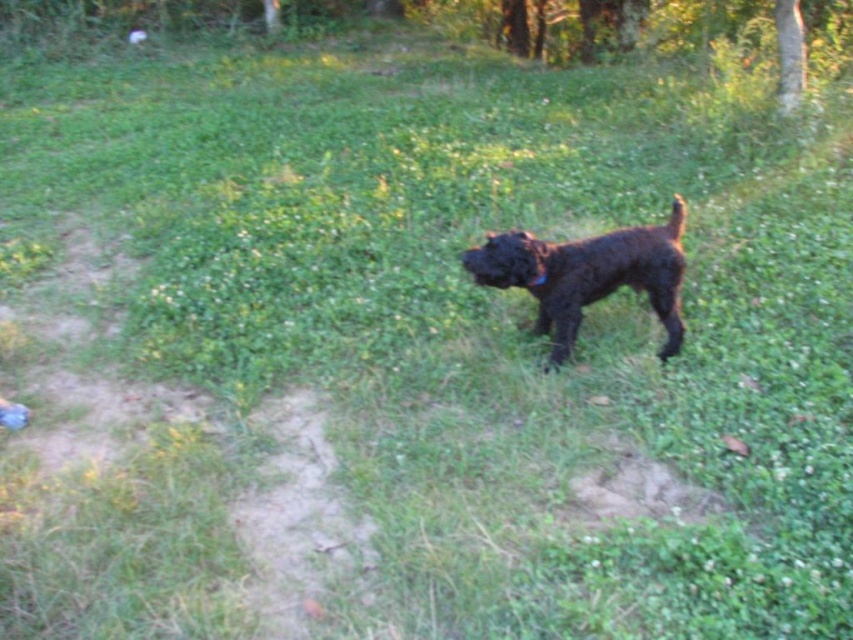
Consider the image. You are a photographer trying to capture the shiny black dog at center and the black fabric neckband at center in a single shot. Based on their positions, can you determine which object is closer to the camera?

The shiny black dog at center is above the black fabric neckband at center, so the dog is closer to the camera than the neckband.

You are a photographer trying to capture the shiny black dog at center and the black fabric neckband at center in the same frame. Based on their positions, will the neckband be visible behind the dog or in front of it?

The shiny black dog at center is in front of the black fabric neckband at center, so the neckband will be visible behind the dog.